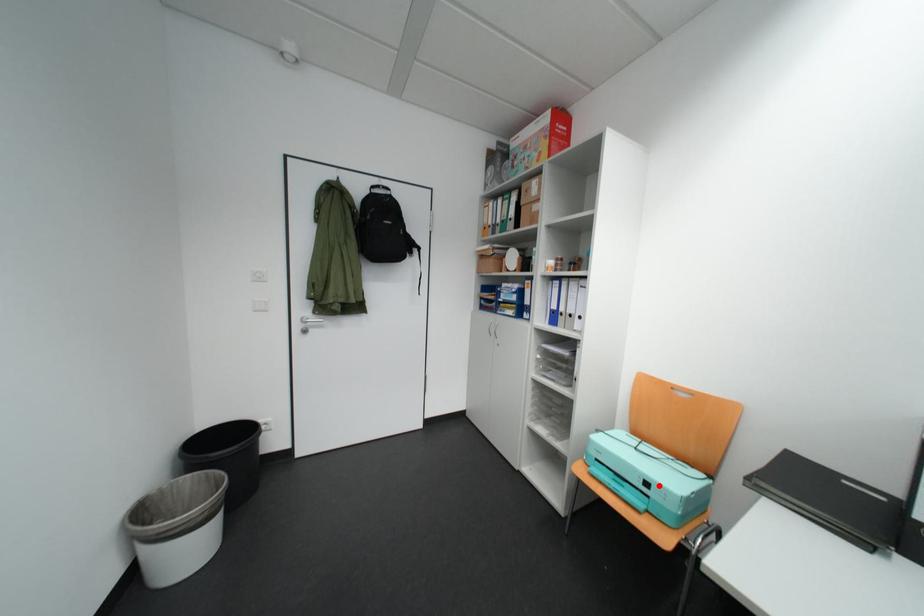
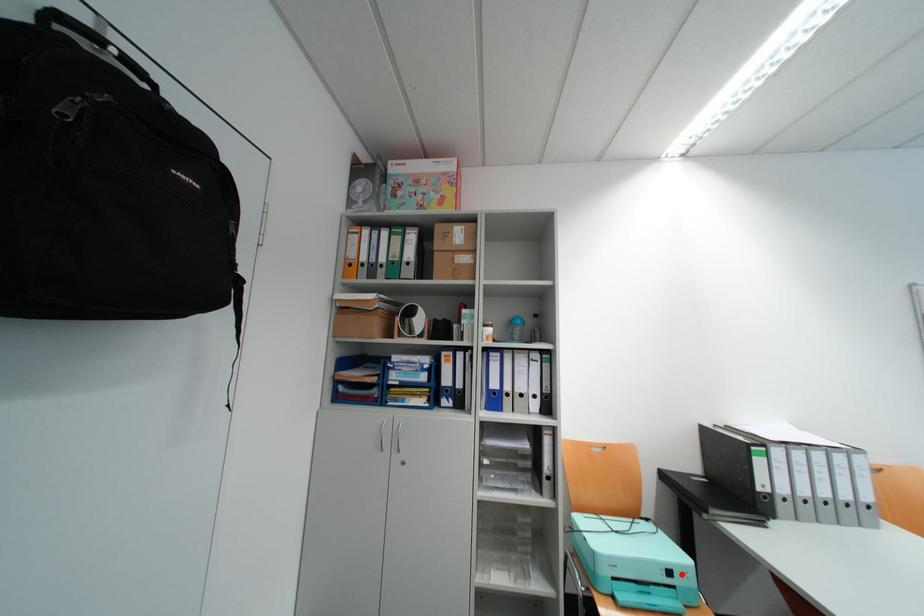
I am providing you with two images of the same scene from different viewpoints. A red point is marked on the first image and another point is marked on the second image. Does the point marked in image1 correspond to the same location as the one in image2?

Yes